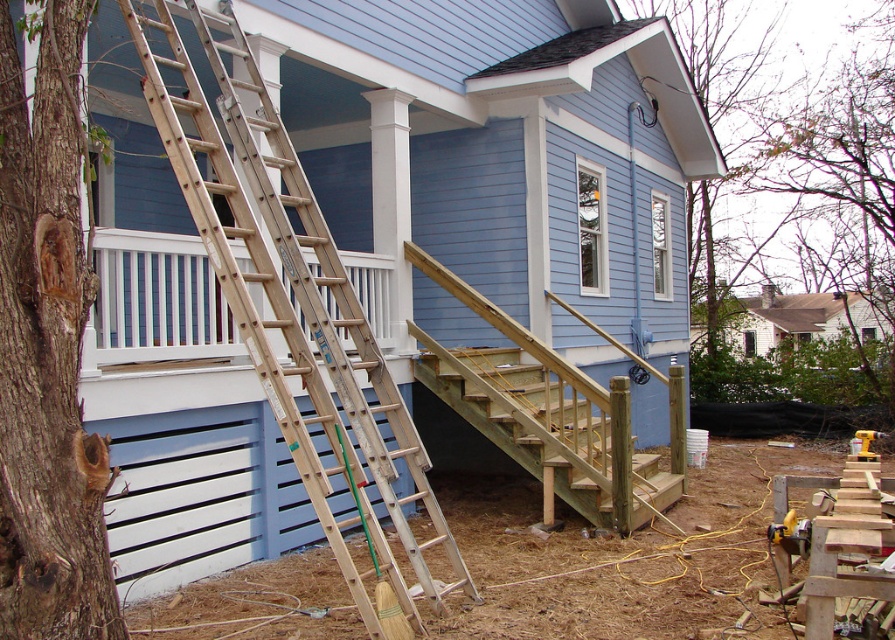
Can you confirm if wooden ladder at left is bigger than brown rough bark tree at left?

Yes.

Is point (320, 506) behind point (13, 109)?

Yes.

Is point (337, 451) farther from viewer compared to point (67, 602)?

Yes, it is behind point (67, 602).

Where is `wooden ladder at left`? wooden ladder at left is located at coordinates (293, 305).

Does brown rough bark tree at left have a greater width compared to wooden stairs at center?

Incorrect, brown rough bark tree at left's width does not surpass wooden stairs at center's.

In the scene shown: Does brown rough bark tree at left have a lesser width compared to wooden stairs at center?

Yes, brown rough bark tree at left is thinner than wooden stairs at center.

Is point (84, 552) in front of point (526, 458)?

That is True.

Locate an element on the screen. This screenshot has height=640, width=895. brown rough bark tree at left is located at coordinates (47, 349).

Between wooden ladder at left and wooden stairs at center, which one appears on the right side from the viewer's perspective?

From the viewer's perspective, wooden stairs at center appears more on the right side.

Is wooden ladder at left positioned behind wooden stairs at center?

No.

Between point (156, 120) and point (544, 451), which one is positioned in front?

Point (156, 120) is more forward.

This screenshot has height=640, width=895. What are the coordinates of `wooden ladder at left` in the screenshot? It's located at (293, 305).